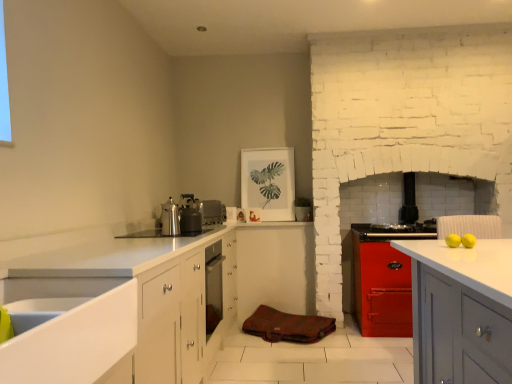
What is the approximate height of satin silver toaster at center, the second appliance in the left-to-right sequence?

It is 8.83 inches.

Describe the element at coordinates (69, 330) in the screenshot. The image size is (512, 384). I see `white glossy sink at lower left` at that location.

This screenshot has height=384, width=512. In order to click on shiny metallic kettle at center in this screenshot , I will do `click(170, 218)`.

This screenshot has width=512, height=384. Describe the element at coordinates (170, 218) in the screenshot. I see `shiny metallic kettle at center` at that location.

What do you see at coordinates (190, 216) in the screenshot?
I see `metallic silver kettle at upper center, arranged as the first appliance when viewed from the front` at bounding box center [190, 216].

Where is `satin silver toaster at center, which ranks as the 2th appliance in front-to-back order`? satin silver toaster at center, which ranks as the 2th appliance in front-to-back order is located at coordinates (211, 211).

Looking at this image, from the image's perspective, is brown leather bag at center located above or below satin silver toaster at center, the second appliance in the left-to-right sequence?

brown leather bag at center is below satin silver toaster at center, the second appliance in the left-to-right sequence.

Considering the sizes of objects brown leather bag at center and satin silver toaster at center, the second appliance in the left-to-right sequence, in the image provided, who is taller, brown leather bag at center or satin silver toaster at center, the second appliance in the left-to-right sequence,?

satin silver toaster at center, the second appliance in the left-to-right sequence, is taller.

Would you consider brown leather bag at center to be distant from satin silver toaster at center, the second appliance when ordered from back to front?

Indeed, brown leather bag at center is not near satin silver toaster at center, the second appliance when ordered from back to front.

Does brown leather bag at center have a lesser width compared to satin silver toaster at center, the second appliance in the left-to-right sequence?

In fact, brown leather bag at center might be wider than satin silver toaster at center, the second appliance in the left-to-right sequence.

Is white glossy sink at lower left inside metallic silver kettle at upper center, arranged as the first appliance when viewed from the front?

That's incorrect, white glossy sink at lower left is not inside metallic silver kettle at upper center, arranged as the first appliance when viewed from the front.

How different are the orientations of metallic silver kettle at upper center, the third appliance in the back-to-front sequence, and white glossy sink at lower left in degrees?

0.525 degrees separate the facing orientations of metallic silver kettle at upper center, the third appliance in the back-to-front sequence, and white glossy sink at lower left.

Is metallic silver kettle at upper center, the third appliance in the right-to-left sequence, taller than white glossy sink at lower left?

Indeed, metallic silver kettle at upper center, the third appliance in the right-to-left sequence, has a greater height compared to white glossy sink at lower left.

Considering the sizes of objects metallic silver kettle at upper center, arranged as the first appliance when viewed from the front, and white glossy sink at lower left in the image provided, who is bigger, metallic silver kettle at upper center, arranged as the first appliance when viewed from the front, or white glossy sink at lower left?

With larger size is white glossy sink at lower left.

Which is in front, metallic silver kettle at upper center, arranged as the first appliance when viewed from the left, or metallic stove at center, which is the 1th appliance from back to front?

metallic silver kettle at upper center, arranged as the first appliance when viewed from the left, is closer to the camera.

How far apart are metallic silver kettle at upper center, the third appliance in the back-to-front sequence, and metallic stove at center, which is the 1th appliance from back to front?

metallic silver kettle at upper center, the third appliance in the back-to-front sequence, is 6.46 feet from metallic stove at center, which is the 1th appliance from back to front.

Is metallic silver kettle at upper center, arranged as the first appliance when viewed from the left, directly adjacent to metallic stove at center, which appears as the 3th appliance when viewed from the left?

No, metallic silver kettle at upper center, arranged as the first appliance when viewed from the left, is not touching metallic stove at center, which appears as the 3th appliance when viewed from the left.

Consider the image. Is white glossy sink at lower left surrounding satin silver toaster at center, the second appliance in the left-to-right sequence?

Actually, satin silver toaster at center, the second appliance in the left-to-right sequence, is outside white glossy sink at lower left.

Considering their positions, is white glossy sink at lower left located in front of or behind satin silver toaster at center, which is the second appliance in right-to-left order?

In the image, white glossy sink at lower left appears in front of satin silver toaster at center, which is the second appliance in right-to-left order.

Is white glossy sink at lower left wider or thinner than satin silver toaster at center, which is the second appliance in right-to-left order?

Clearly, white glossy sink at lower left has more width compared to satin silver toaster at center, which is the second appliance in right-to-left order.

Looking at this image, is satin silver toaster at center, which ranks as the 2th appliance in front-to-back order, at the back of white glossy sink at lower left?

No.

Are brown leather bag at center and metallic silver kettle at upper center, the third appliance in the back-to-front sequence, making contact?

No, brown leather bag at center is not next to metallic silver kettle at upper center, the third appliance in the back-to-front sequence.

Where is `material on the right of metallic silver kettle at upper center, the third appliance in the right-to-left sequence`? material on the right of metallic silver kettle at upper center, the third appliance in the right-to-left sequence is located at coordinates [x=287, y=326].

Which of these two, brown leather bag at center or metallic silver kettle at upper center, arranged as the first appliance when viewed from the left, is smaller?

With smaller size is metallic silver kettle at upper center, arranged as the first appliance when viewed from the left.

In the scene shown: Can you confirm if brown leather bag at center is shorter than metallic silver kettle at upper center, arranged as the first appliance when viewed from the front?

Correct, brown leather bag at center is not as tall as metallic silver kettle at upper center, arranged as the first appliance when viewed from the front.

From the image's perspective, which object appears higher, shiny metallic kettle at center or white glossy sink at lower left?

shiny metallic kettle at center, from the image's perspective.

Between shiny metallic kettle at center and white glossy sink at lower left, which one appears on the right side from the viewer's perspective?

shiny metallic kettle at center.

This screenshot has height=384, width=512. I want to click on kitchen appliance above the white glossy sink at lower left (from a real-world perspective), so click(x=170, y=218).

From a real-world perspective, is shiny metallic kettle at center on white glossy sink at lower left?

Yes, from a real-world perspective, shiny metallic kettle at center is on top of white glossy sink at lower left.

The width and height of the screenshot is (512, 384). In the image, there is a shiny metallic kettle at center. In order to click on material below it (from the image's perspective) in this screenshot , I will do `click(287, 326)`.

Does point (177, 235) come closer to viewer compared to point (250, 324)?

Yes, it is in front of point (250, 324).

From a real-world perspective, is shiny metallic kettle at center physically located above or below brown leather bag at center?

Clearly, from a real-world perspective, shiny metallic kettle at center is above brown leather bag at center.

Consider the image. Is shiny metallic kettle at center far from brown leather bag at center?

Yes.

You are a GUI agent. You are given a task and a screenshot of the screen. Output one action in this format:
    pyautogui.click(x=<x>, y=<y>)
    Task: Click on the 1st appliance located above the brown leather bag at center (from a real-world perspective)
    
    Given the screenshot: What is the action you would take?
    pyautogui.click(x=211, y=211)

Image resolution: width=512 pixels, height=384 pixels. In order to click on sink below the metallic silver kettle at upper center, the third appliance in the right-to-left sequence (from a real-world perspective) in this screenshot , I will do `click(69, 330)`.

When comparing their distances from metallic silver kettle at upper center, arranged as the first appliance when viewed from the left, does brown leather bag at center or metallic stove at center, which is counted as the third appliance, starting from the front, seem closer?

Based on the image, brown leather bag at center appears to be nearer to metallic silver kettle at upper center, arranged as the first appliance when viewed from the left.

From the image, which object appears to be farther from satin silver toaster at center, the second appliance in the left-to-right sequence, metallic silver kettle at upper center, arranged as the first appliance when viewed from the front, or brown leather bag at center?

Among the two, brown leather bag at center is located further to satin silver toaster at center, the second appliance in the left-to-right sequence.

Estimate the real-world distances between objects in this image. Which object is closer to metallic silver kettle at upper center, arranged as the first appliance when viewed from the left, metallic stove at center, arranged as the 1th appliance when viewed from the right, or satin silver toaster at center, the second appliance in the left-to-right sequence?

satin silver toaster at center, the second appliance in the left-to-right sequence, lies closer to metallic silver kettle at upper center, arranged as the first appliance when viewed from the left, than the other object.

In the scene shown: When comparing their distances from metallic silver kettle at upper center, arranged as the first appliance when viewed from the left, does shiny metallic kettle at center or brown leather bag at center seem further?

brown leather bag at center lies further to metallic silver kettle at upper center, arranged as the first appliance when viewed from the left, than the other object.

Looking at the image, which one is located closer to shiny metallic kettle at center, satin silver toaster at center, the second appliance in the left-to-right sequence, or metallic silver kettle at upper center, arranged as the first appliance when viewed from the front?

metallic silver kettle at upper center, arranged as the first appliance when viewed from the front, is positioned closer to the anchor shiny metallic kettle at center.

Which object lies nearer to the anchor point metallic silver kettle at upper center, the third appliance in the right-to-left sequence, shiny metallic kettle at center or satin silver toaster at center, the second appliance when ordered from back to front?

Based on the image, shiny metallic kettle at center appears to be nearer to metallic silver kettle at upper center, the third appliance in the right-to-left sequence.

When comparing their distances from satin silver toaster at center, the second appliance in the left-to-right sequence, does shiny metallic kettle at center or metallic stove at center, which is the 1th appliance from back to front, seem further?

metallic stove at center, which is the 1th appliance from back to front, is further to satin silver toaster at center, the second appliance in the left-to-right sequence.

Considering their positions, is satin silver toaster at center, which ranks as the 2th appliance in front-to-back order, positioned further to brown leather bag at center than white glossy sink at lower left?

white glossy sink at lower left is further to brown leather bag at center.

What are the coordinates of `material between metallic silver kettle at upper center, the third appliance in the back-to-front sequence, and metallic stove at center, which is the 1th appliance from back to front, in the horizontal direction` in the screenshot? It's located at (287, 326).

Where is `appliance between shiny metallic kettle at center and satin silver toaster at center, the second appliance when ordered from back to front, from front to back`? The image size is (512, 384). appliance between shiny metallic kettle at center and satin silver toaster at center, the second appliance when ordered from back to front, from front to back is located at coordinates (190, 216).

Image resolution: width=512 pixels, height=384 pixels. Identify the location of appliance between metallic silver kettle at upper center, arranged as the first appliance when viewed from the left, and brown leather bag at center vertically. (211, 211).

Locate an element on the screen. This screenshot has height=384, width=512. kitchen appliance between white glossy sink at lower left and satin silver toaster at center, which is the second appliance in right-to-left order, from front to back is located at coordinates (170, 218).